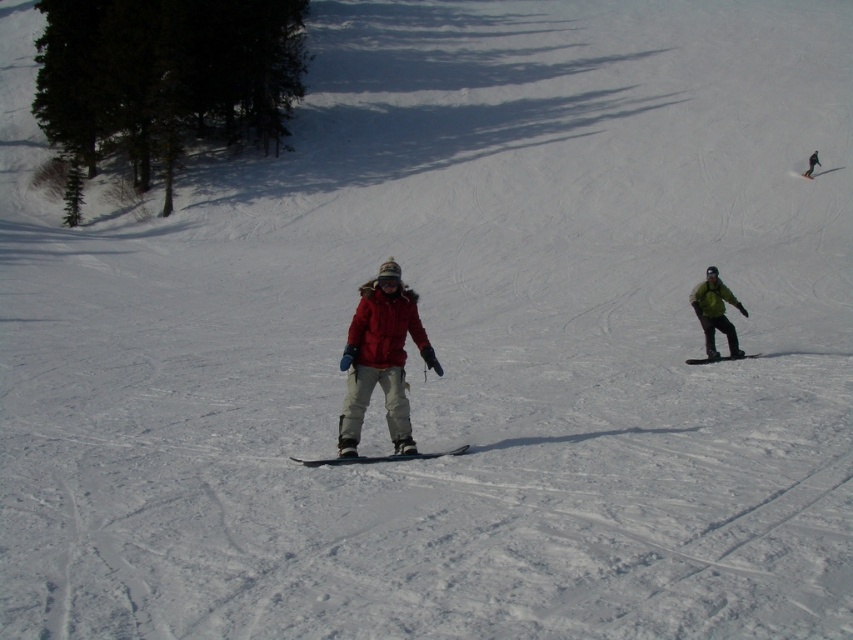
Question: Which of the following is the closest to the observer?

Choices:
 (A) green matte snowboarder at right
 (B) matte black snowboard at center

Answer: (B)

Question: Does green matte snowboarder at right have a smaller size compared to matte black snowboard at center?

Choices:
 (A) no
 (B) yes

Answer: (A)

Question: Observing the image, what is the correct spatial positioning of matte black snowboard at center in reference to black matte snowboard at upper right?

Choices:
 (A) left
 (B) right

Answer: (A)

Question: Which point appears farthest from the camera in this image?

Choices:
 (A) (401, 460)
 (B) (807, 177)

Answer: (B)

Question: Where is matte black snowboard at center located in relation to black matte snowboard at upper right in the image?

Choices:
 (A) below
 (B) above

Answer: (A)

Question: Which point is farther to the camera?

Choices:
 (A) (808, 164)
 (B) (741, 353)
 (C) (838, 166)

Answer: (C)